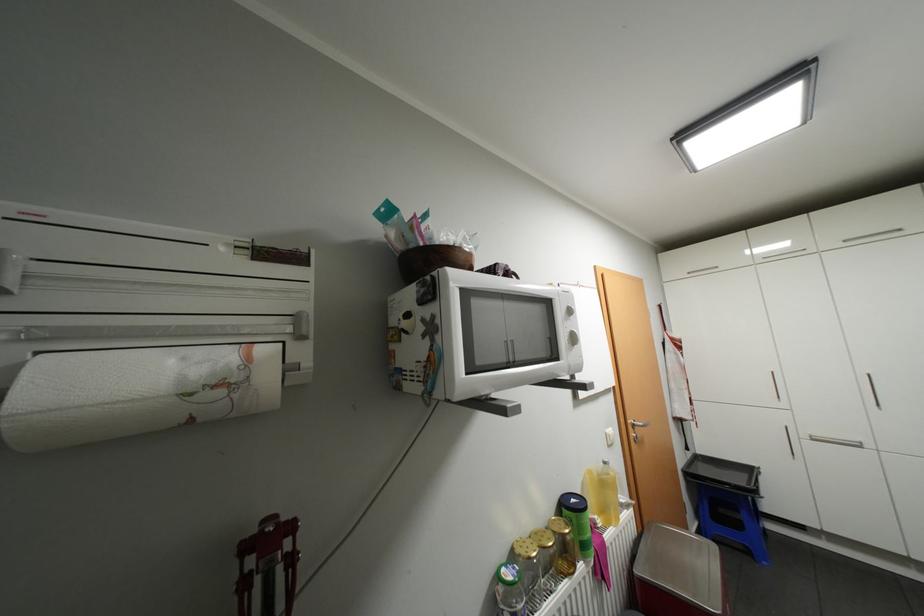
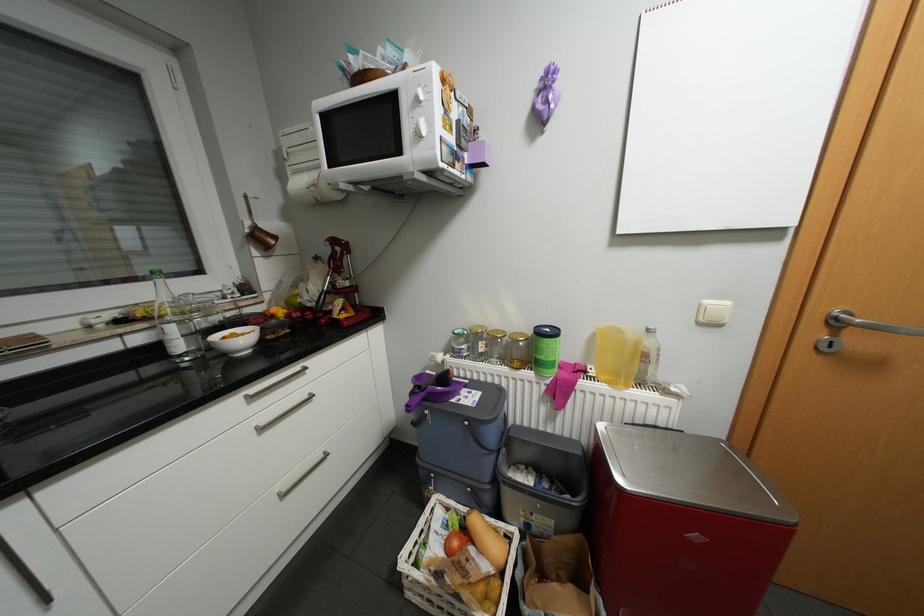
Where in the second image is the point corresponding to [616,445] from the first image?

(708, 323)